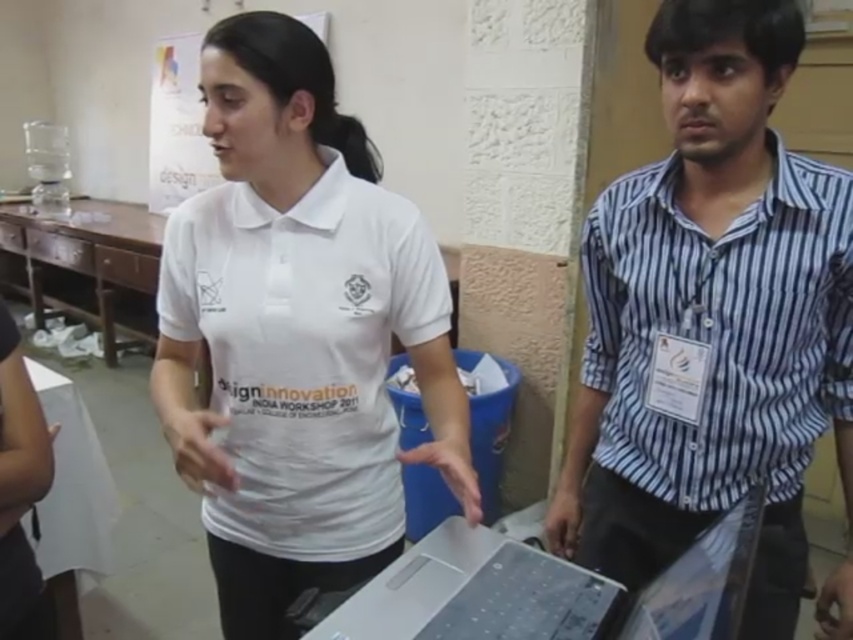
Question: Which object is closer to the camera taking this photo?

Choices:
 (A) silver metallic laptop at center
 (B) white matte shirt at center
 (C) blue striped shirt at right

Answer: (A)

Question: Is white matte shirt at center to the right of blue striped shirt at right from the viewer's perspective?

Choices:
 (A) yes
 (B) no

Answer: (B)

Question: Which point is farther from the camera taking this photo?

Choices:
 (A) (310, 460)
 (B) (788, 372)

Answer: (A)

Question: Is white matte shirt at center below silver metallic laptop at center?

Choices:
 (A) no
 (B) yes

Answer: (A)

Question: Is white matte shirt at center behind silver metallic laptop at center?

Choices:
 (A) yes
 (B) no

Answer: (A)

Question: Which point appears closest to the camera in this image?

Choices:
 (A) (227, 550)
 (B) (753, 522)

Answer: (B)